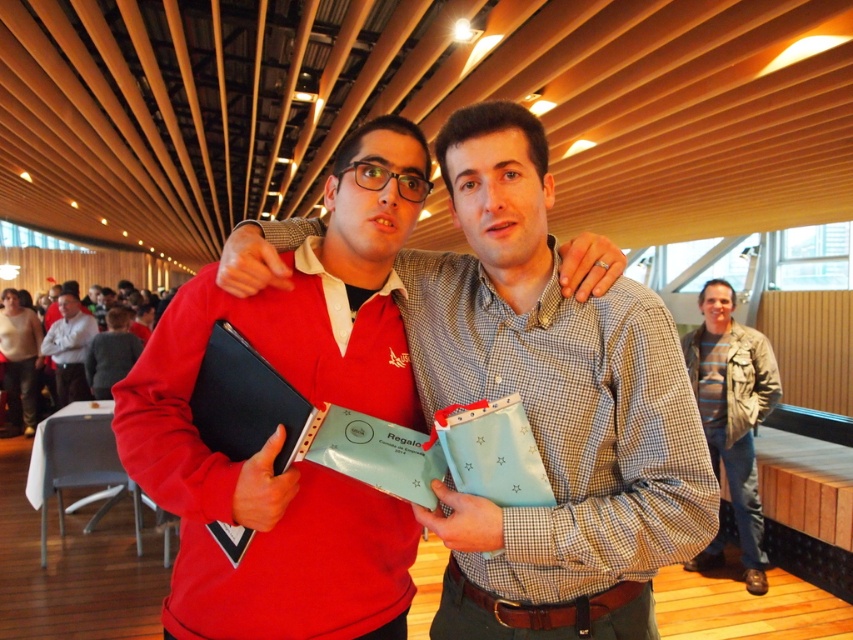
Question: Which point is closer to the camera?

Choices:
 (A) [x=49, y=337]
 (B) [x=567, y=321]

Answer: (B)

Question: Does striped cotton shirt at right appear on the right side of jeans at left?

Choices:
 (A) yes
 (B) no

Answer: (A)

Question: Which object appears farthest from the camera in this image?

Choices:
 (A) light gray shirt at center
 (B) striped cotton shirt at right

Answer: (A)

Question: Is matte black laptop at center to the right of striped cotton shirt at right from the viewer's perspective?

Choices:
 (A) yes
 (B) no

Answer: (B)

Question: Among these objects, which one is farthest from the camera?

Choices:
 (A) light gray shirt at center
 (B) matte black laptop at center

Answer: (A)

Question: Is matte black laptop at center wider than jeans at left?

Choices:
 (A) no
 (B) yes

Answer: (B)